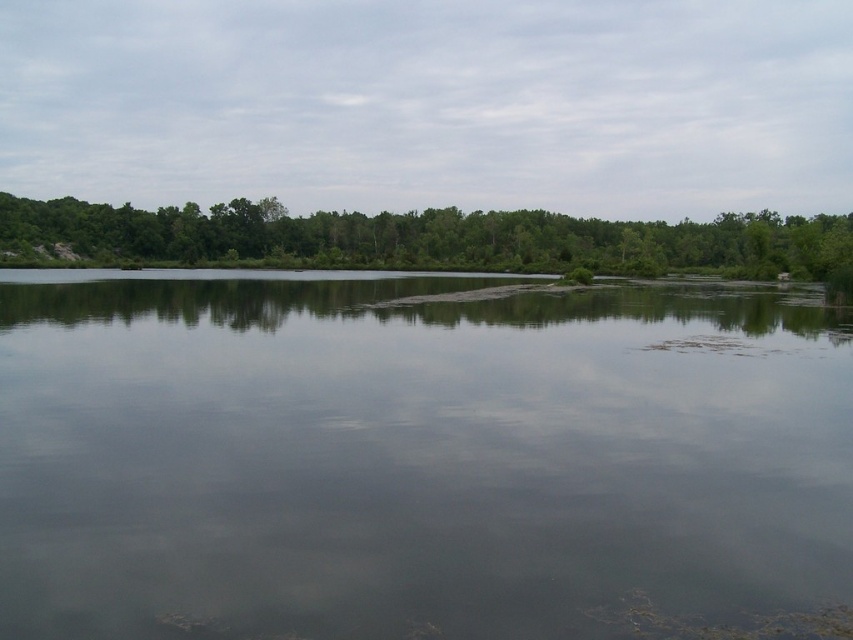
Who is higher up, transparent water at center or green leafy trees at upper center?

green leafy trees at upper center

What do you see at coordinates (416, 460) in the screenshot?
I see `transparent water at center` at bounding box center [416, 460].

Is point (540, 368) positioned before point (93, 243)?

That is True.

This screenshot has width=853, height=640. I want to click on transparent water at center, so click(416, 460).